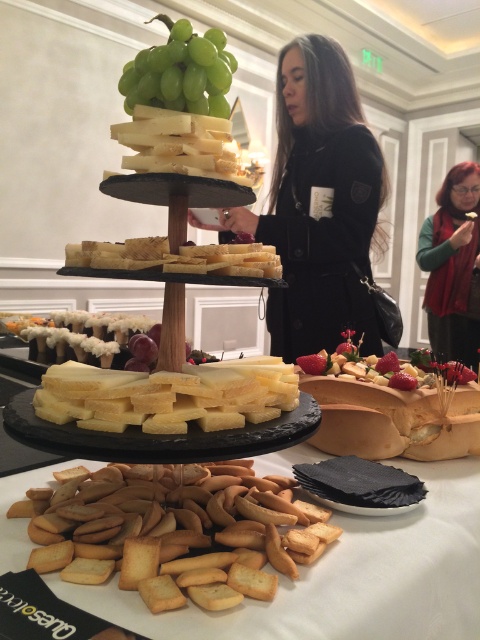
Question: Which object is positioned closest to the shiny gold tray at center?

Choices:
 (A) yellow crumbly cheese at center
 (B) golden crisp crackers at lower center

Answer: (B)

Question: Can you confirm if golden crisp crackers at lower center is bigger than white creamy cheese at center?

Choices:
 (A) no
 (B) yes

Answer: (A)

Question: Which point is farther from the camera taking this photo?

Choices:
 (A) (33, 538)
 (B) (217, 100)
 (C) (189, 211)

Answer: (C)

Question: Can you confirm if green velvet scarf at upper right is thinner than white creamy cheese at center?

Choices:
 (A) no
 (B) yes

Answer: (A)

Question: Among these points, which one is farthest from the camera?

Choices:
 (A) (370, 387)
 (B) (88, 492)

Answer: (A)

Question: Can you confirm if golden crisp crackers at lower center is positioned to the right of yellow crumbly cheese at center?

Choices:
 (A) yes
 (B) no

Answer: (B)